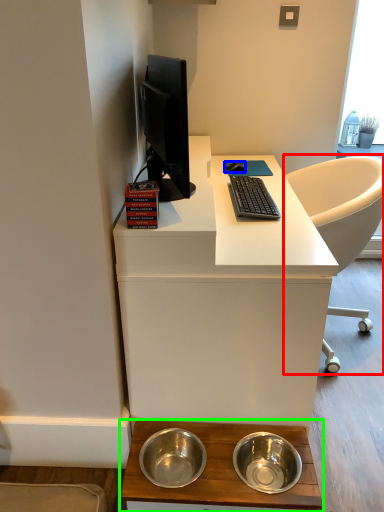
Question: Considering the real-world distances, which object is closest to chair (highlighted by a red box)? mouse (highlighted by a blue box) or desk (highlighted by a green box).

Choices:
 (A) mouse
 (B) desk

Answer: (A)